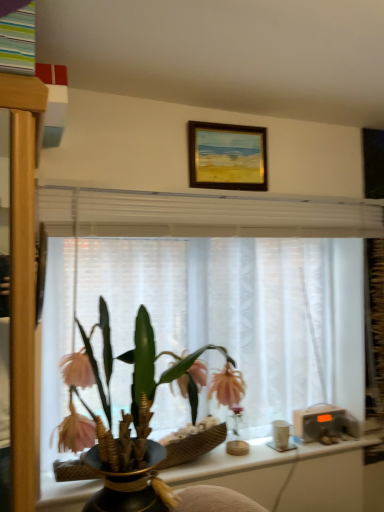
Question: Is point (246, 444) closer or farther from the camera than point (274, 429)?

Choices:
 (A) closer
 (B) farther

Answer: (A)

Question: From a real-world perspective, is transparent glass vase at center physically located above or below white matte cup at right?

Choices:
 (A) above
 (B) below

Answer: (A)

Question: Estimate the real-world distances between objects in this image. Which object is closer to the matte black vase at center?

Choices:
 (A) transparent glass vase at center
 (B) white matte cup at right
 (C) white sheer curtain at center
 (D) gold-framed painting at upper center

Answer: (C)

Question: Estimate the real-world distances between objects in this image. Which object is farther from the gold-framed painting at upper center?

Choices:
 (A) white matte cup at right
 (B) white sheer curtain at center
 (C) transparent glass vase at center
 (D) matte black vase at center

Answer: (A)